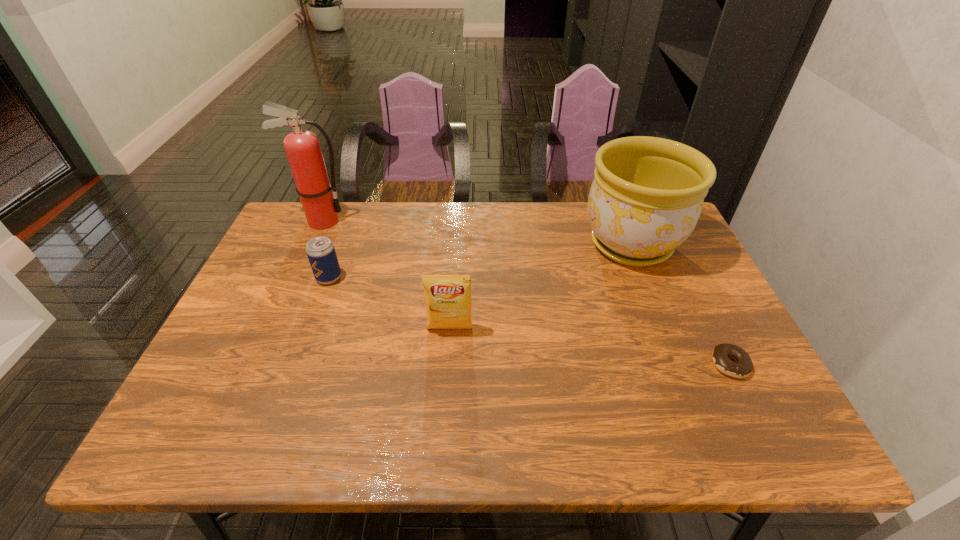
Where is `the tallest object`? This screenshot has width=960, height=540. the tallest object is located at coordinates (321, 207).

You are a GUI agent. You are given a task and a screenshot of the screen. Output one action in this format:
    pyautogui.click(x=<x>, y=<y>)
    Task: Click on the flowerpot
    This screenshot has width=960, height=540.
    Given the screenshot: What is the action you would take?
    pyautogui.click(x=646, y=197)

Where is `the third shortest object`? Image resolution: width=960 pixels, height=540 pixels. the third shortest object is located at coordinates (448, 297).

This screenshot has height=540, width=960. Find the location of `crisp (potato chip)`. crisp (potato chip) is located at coordinates (448, 297).

I want to click on beer can, so click(321, 253).

Identify the location of the nearest object. (721, 355).

The width and height of the screenshot is (960, 540). I want to click on doughnut, so click(721, 355).

The width and height of the screenshot is (960, 540). I want to click on free space located on the hose direction of the tallest object, so click(369, 221).

I want to click on free space located on the left of the flowerpot, so [x=448, y=245].

At what (x,y) coordinates should I click in order to perform the action: click on vacant space located 0.190m on the front of the third tallest object with the logo. Please return your answer as a coordinate pair (x, y). The height and width of the screenshot is (540, 960). Looking at the image, I should click on (444, 406).